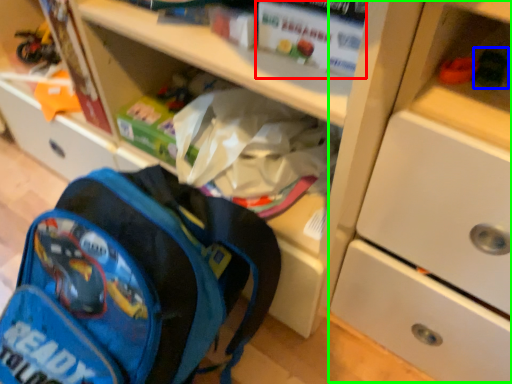
Question: Estimate the real-world distances between objects in this image. Which object is closer to paperback book (highlighted by a red box), toy (highlighted by a blue box) or cabinetry (highlighted by a green box)?

Choices:
 (A) toy
 (B) cabinetry

Answer: (A)